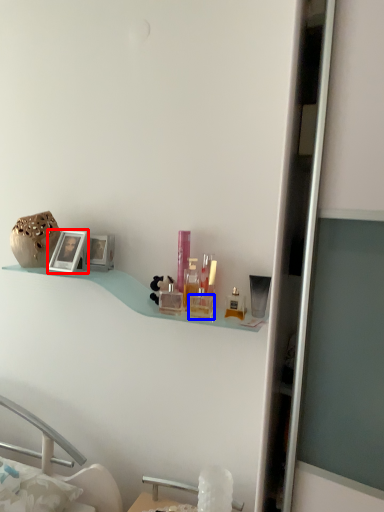
Question: Which object is closer to the camera taking this photo, picture frame (highlighted by a red box) or toiletry (highlighted by a blue box)?

Choices:
 (A) picture frame
 (B) toiletry

Answer: (B)